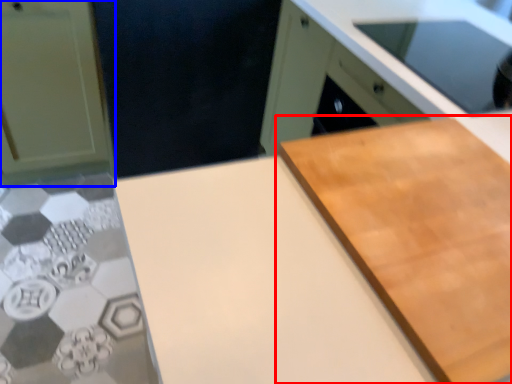
Question: Which object is further to the camera taking this photo, cutting board (highlighted by a red box) or cabinetry (highlighted by a blue box)?

Choices:
 (A) cutting board
 (B) cabinetry

Answer: (B)